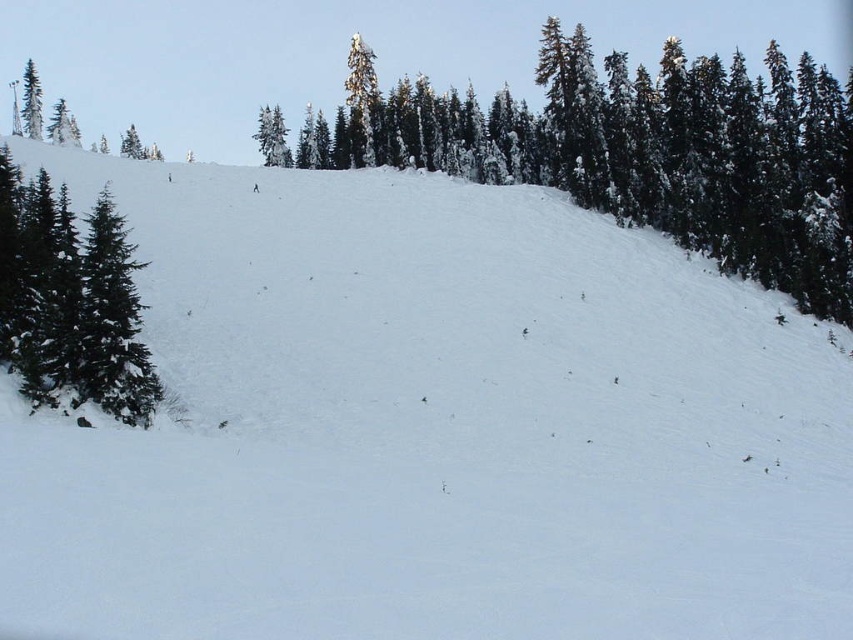
You are an observer standing at the bottom of the slope. Which of the two trees, the green textured trees at upper center or the green matte tree at left, is positioned more to the right side of the slope?

The green textured trees at upper center are positioned more to the right side of the slope compared to the green matte tree at left.

You are standing at the bottom of the slope and want to reach the top. There are two points marked on the slope. Which point, point [793,195] or point [0,172], is closer to you?

Point [0,172] is closer to you because it is closer to the bottom of the slope than point [793,195], which is further away.